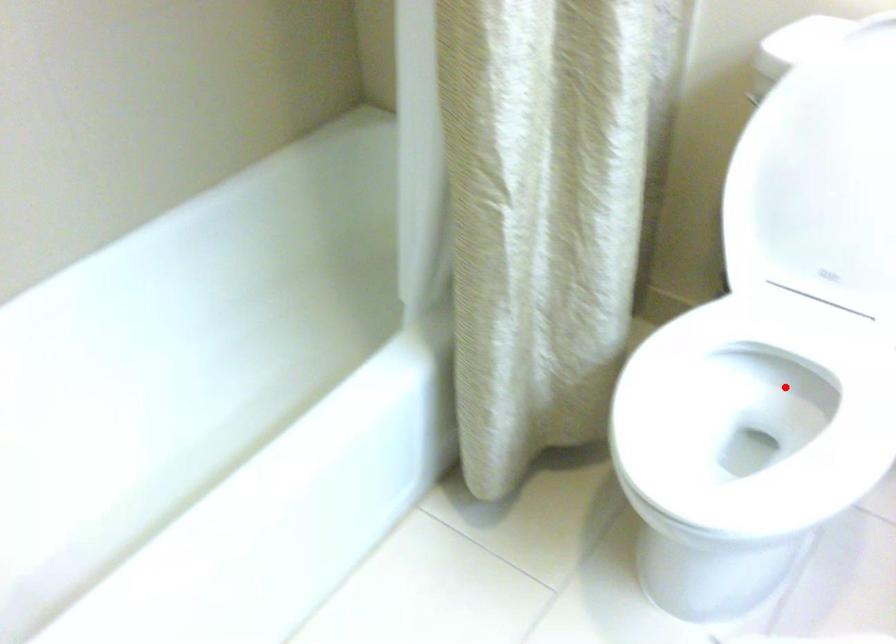
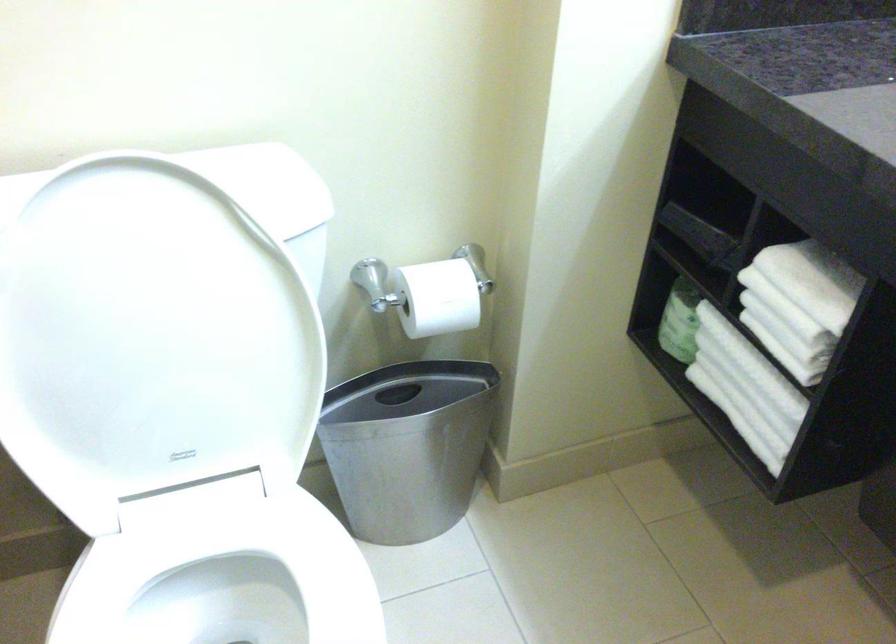
Find the pixel in the second image that matches the highlighted location in the first image.

(225, 581)